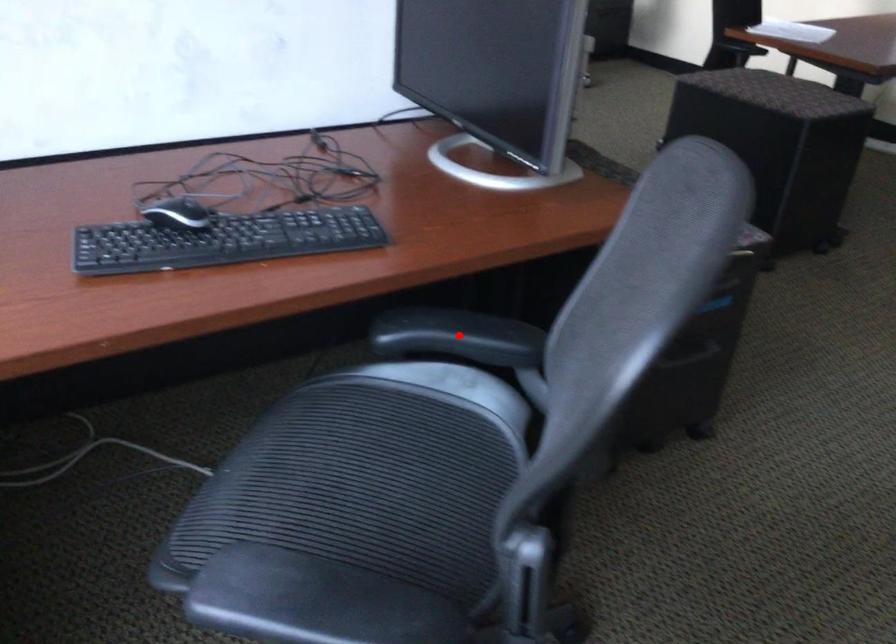
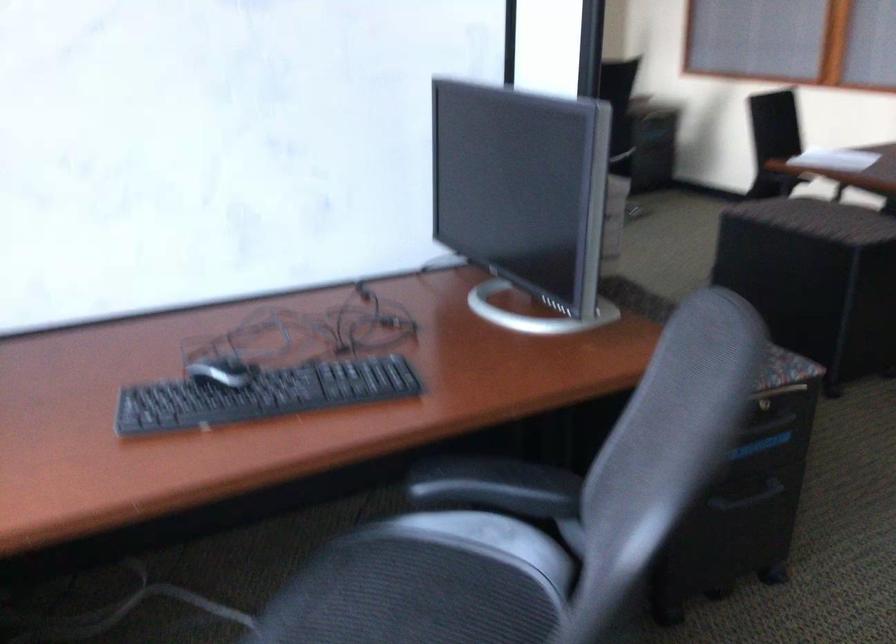
Locate, in the second image, the point that corresponds to the highlighted location in the first image.

(495, 486)